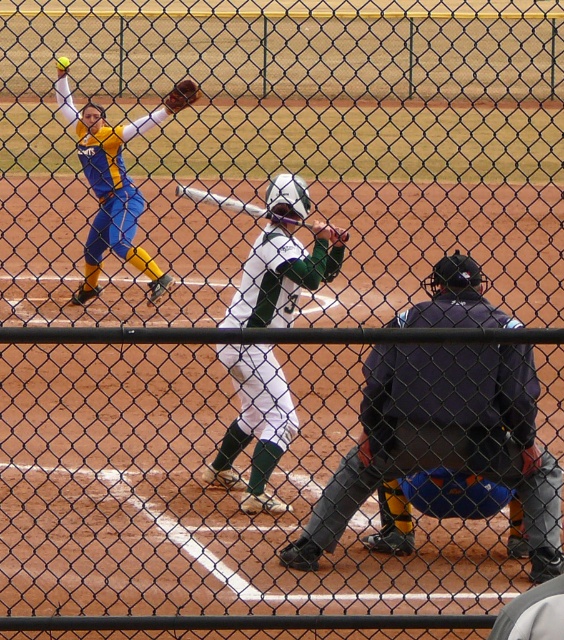
You are a spectator standing behind the chain link fence watching the softball game. You notice the dark blue padded jacket at center and the metallic silver bat at center. Which object is closer to the ground?

The dark blue padded jacket at center is positioned under the metallic silver bat at center, so it is closer to the ground.

You are a spectator standing behind the chain link fence watching the softball game. You notice two uniforms at the center of the image. Which uniform is closer to you, the dark blue padded jacket at center or the white matte uniform at center?

The dark blue padded jacket at center is closer to you because it is in front of the white matte uniform at center.